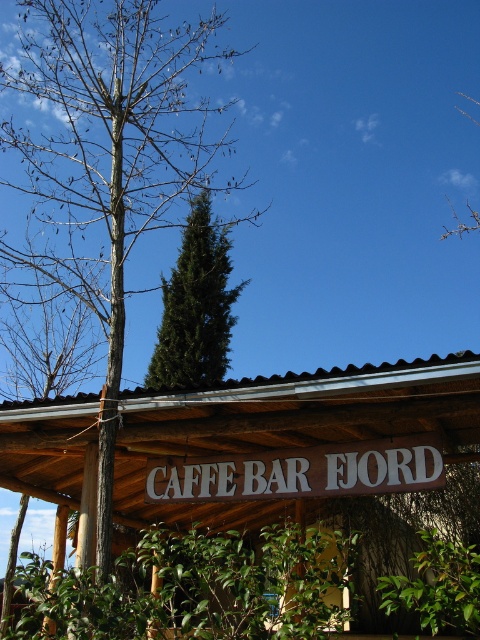
Between bare wood tree at upper left and green coniferous tree at upper center, which one has more height?

Standing taller between the two is bare wood tree at upper left.

Is bare wood tree at upper left to the left of green coniferous tree at upper center from the viewer's perspective?

Yes, bare wood tree at upper left is to the left of green coniferous tree at upper center.

Which is behind, point (48, 134) or point (191, 296)?

The point (48, 134) is behind.

Where is `bare wood tree at upper left`? The image size is (480, 640). bare wood tree at upper left is located at coordinates (104, 163).

Does bare wood tree at upper left have a greater width compared to white wood sign at center?

Yes.

What do you see at coordinates (104, 163) in the screenshot?
I see `bare wood tree at upper left` at bounding box center [104, 163].

Which is behind, point (115, 90) or point (197, 467)?

The point (115, 90) is behind.

Find the location of a particular element. bare wood tree at upper left is located at coordinates (104, 163).

Is wooden signboard at center smaller than bare wood tree at upper left?

Correct, wooden signboard at center occupies less space than bare wood tree at upper left.

Identify the location of wooden signboard at center. tap(291, 442).